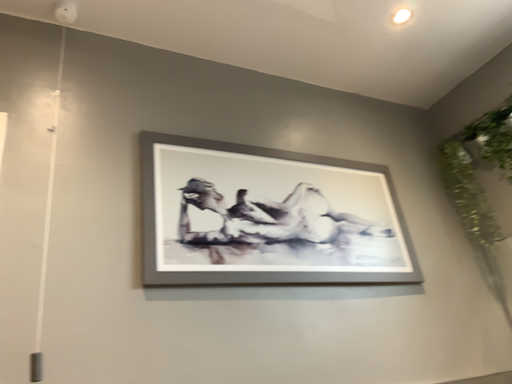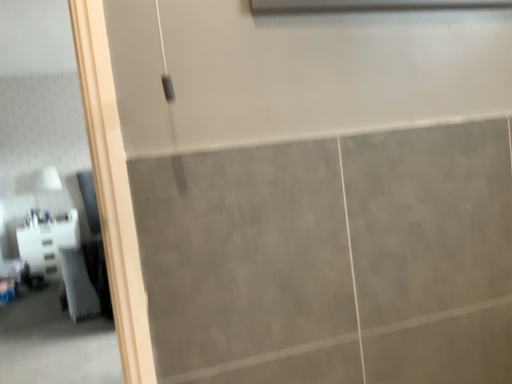
Question: Which way did the camera rotate in the video?

Choices:
 (A) rotated downward
 (B) rotated upward

Answer: (A)